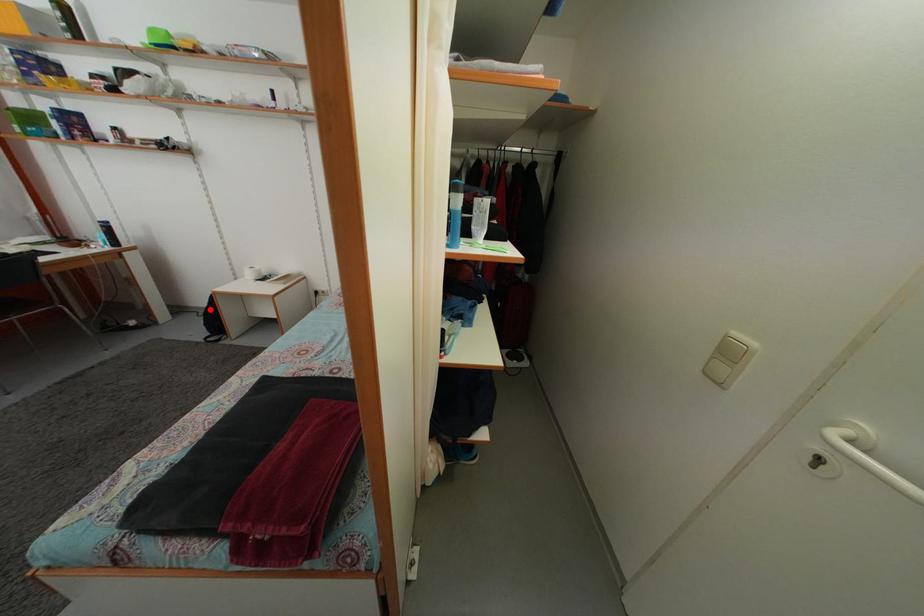
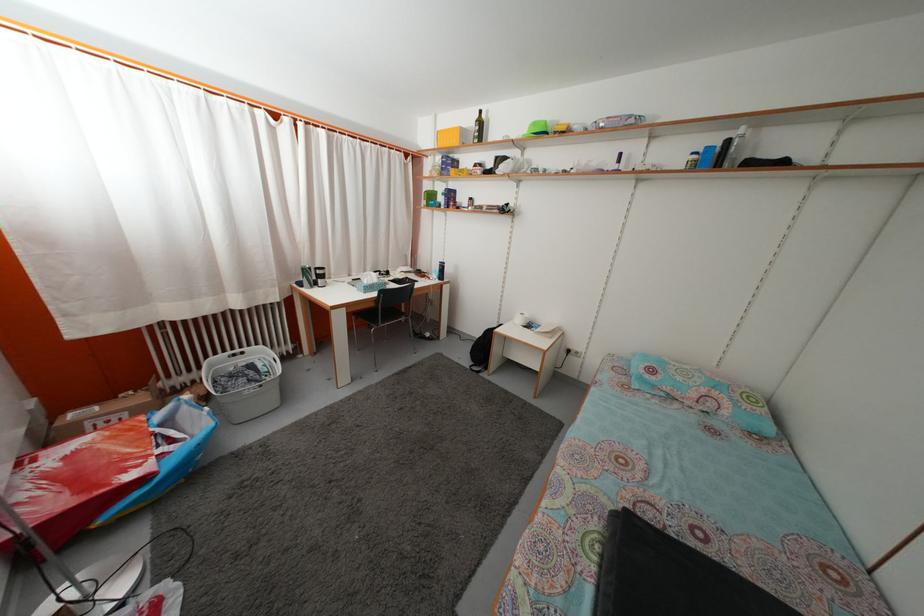
Question: I am providing you with two images of the same scene from different viewpoints. A red point is marked on the first image. At the location where the point appears in image 1, is it still visible in image 2?

Choices:
 (A) Yes
 (B) No

Answer: (A)